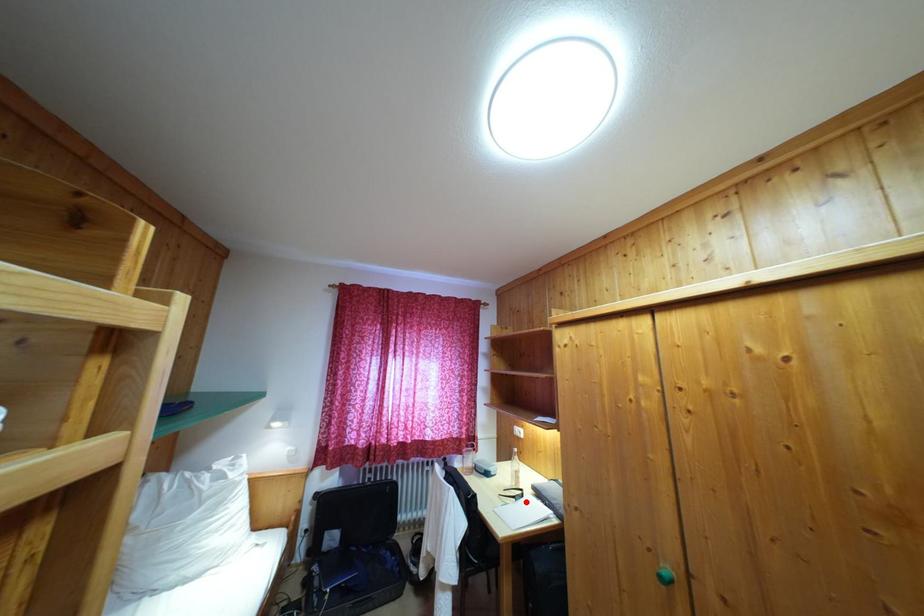
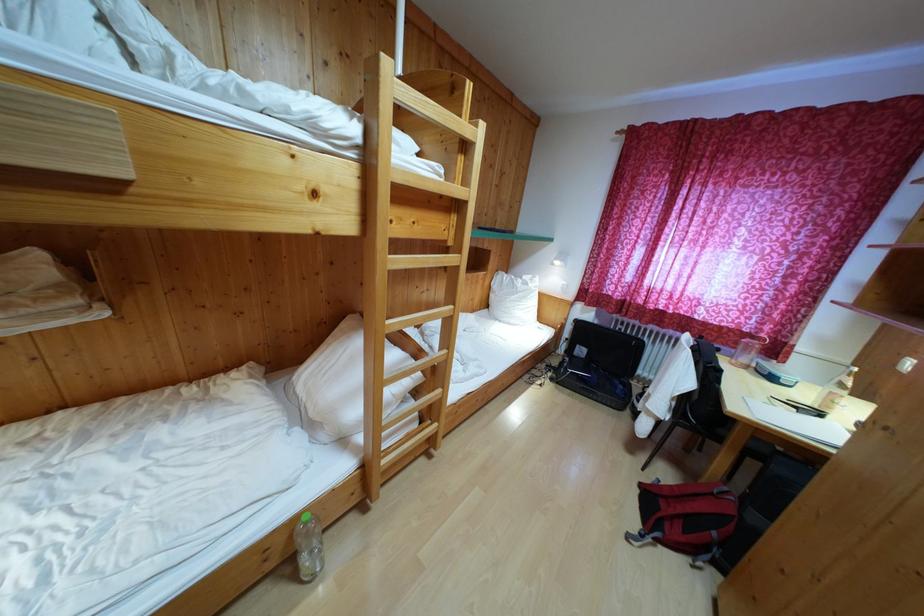
Question: I am providing you with two images of the same scene from different viewpoints. A red point is marked on the first image. Is the red point's position out of view in image 2?

Choices:
 (A) Yes
 (B) No

Answer: (A)